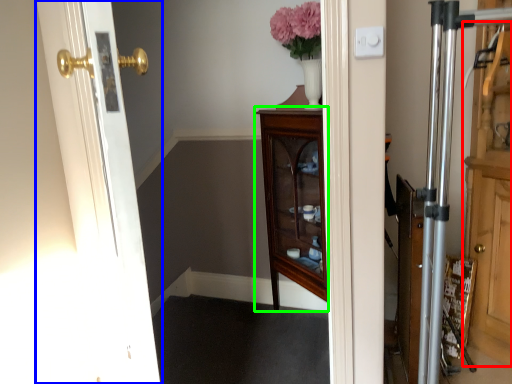
Question: Considering the real-world distances, which object is closest to dresser (highlighted by a red box)? door (highlighted by a blue box) or furniture (highlighted by a green box).

Choices:
 (A) door
 (B) furniture

Answer: (B)